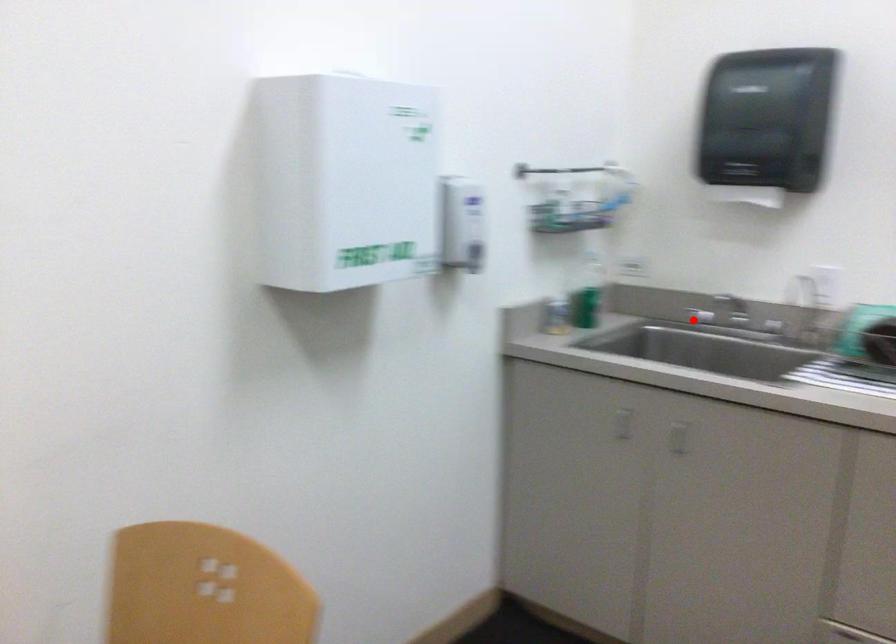
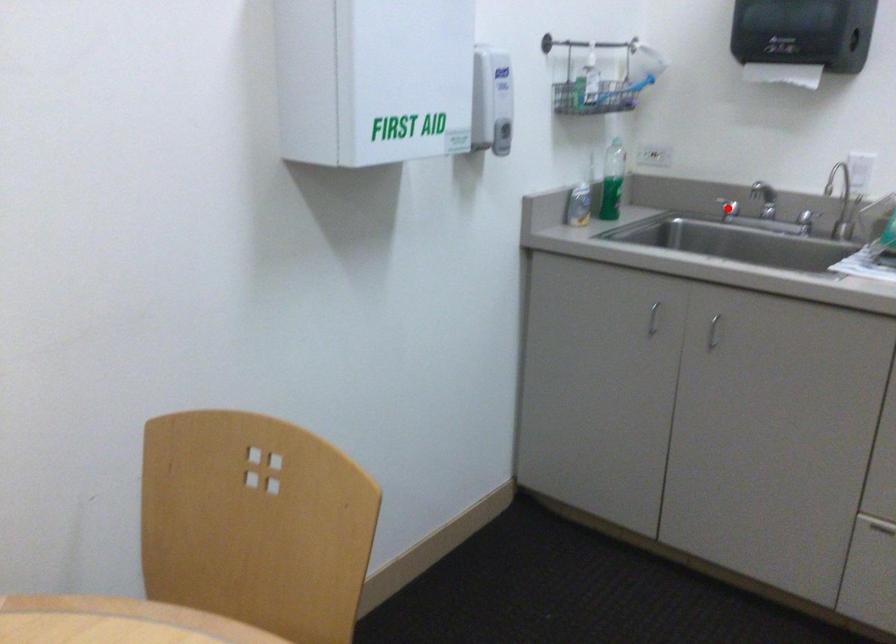
Looking at this image, I am providing you with two images of the same scene from different viewpoints. A red point is marked on the first image and another point is marked on the second image. Are the points marked in image1 and image2 representing the same 3D position?

Yes